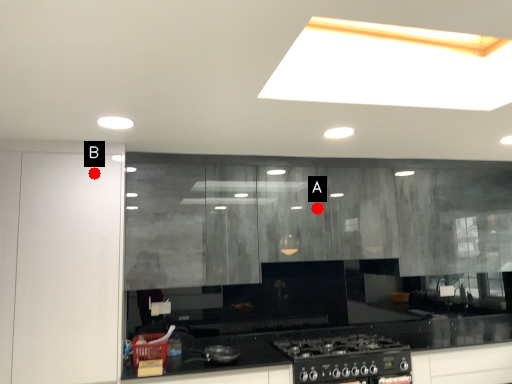
Question: Two points are circled on the image, labeled by A and B beside each circle. Which of the following is the farthest from the observer?

Choices:
 (A) A is further
 (B) B is further

Answer: (A)